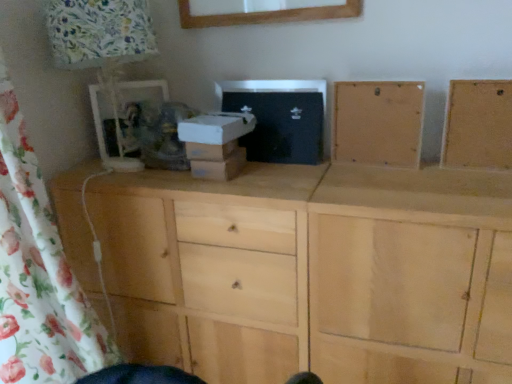
Question: Is point (354, 117) positioned closer to the camera than point (230, 152)?

Choices:
 (A) farther
 (B) closer

Answer: (A)

Question: Considering the positions of light wood cabinet at center, arranged as the 2th cabinetry when viewed from the right, and white cardboard box at center in the image, is light wood cabinet at center, arranged as the 2th cabinetry when viewed from the right, taller or shorter than white cardboard box at center?

Choices:
 (A) tall
 (B) short

Answer: (A)

Question: Which object is the closest to the natural wood cabinet at center?

Choices:
 (A) white cardboard box at center
 (B) floral fabric lampshade at left
 (C) light wood cabinet at center, the first cabinetry positioned from the left
 (D) natural wood frame at upper right, positioned as the second cabinetry in left-to-right order

Answer: (A)

Question: Which of these objects is positioned closest to the white cardboard box at center?

Choices:
 (A) light wood cabinet at center, arranged as the 2th cabinetry when viewed from the right
 (B) natural wood frame at upper right, positioned as the second cabinetry in left-to-right order
 (C) natural wood cabinet at center
 (D) floral fabric lampshade at left

Answer: (D)